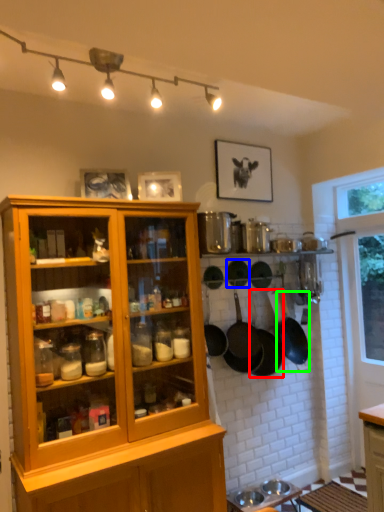
Question: Which object is the farthest from frying pan (highlighted by a red box)? Choose among these: frying pan (highlighted by a blue box) or frying pan (highlighted by a green box).

Choices:
 (A) frying pan
 (B) frying pan

Answer: (A)